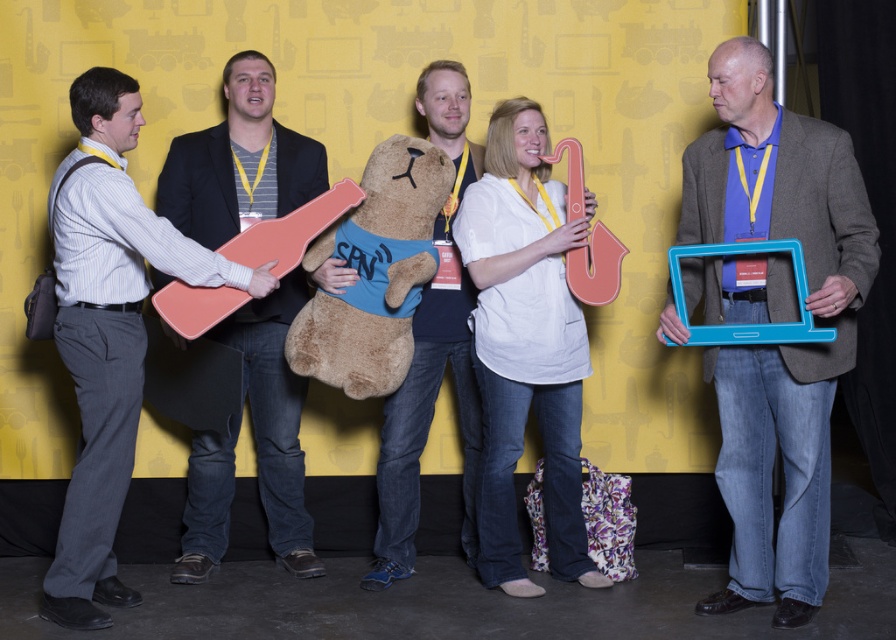
You are a photographer standing in front of the scene. You want to take a photo of the soft plush bear at center without any obstruction from the matte black guitar at left. Is this possible?

The soft plush bear at center is behind the matte black guitar at left, so it will be obstructed. To capture the bear without obstruction, you need to move to a position where the bear is no longer behind the guitar, or adjust the angle so the guitar doesn not block the view.

You are standing in front of the image and want to touch the points shown. Which of the two points, point [502,186] or point [381,506], would feel closer to your hand when you reach out?

Point [502,186] is closer to the camera than point [381,506], so it would feel closer to your hand when you reach out.